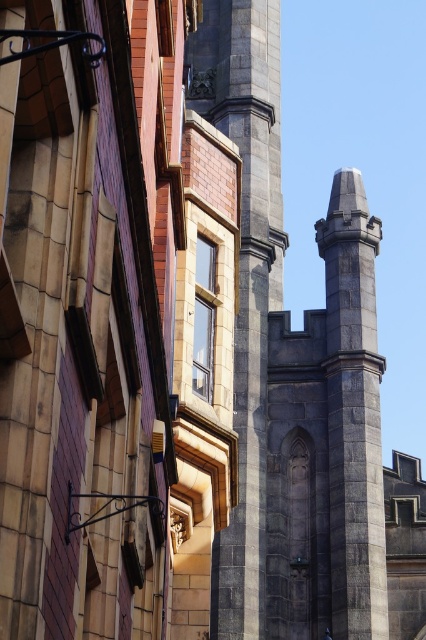
Measure the distance from gray stone tower at center to gray stone pillar at center.

They are 7.90 meters apart.

Which is above, gray stone tower at center or gray stone pillar at center?

Positioned higher is gray stone tower at center.

Measure the distance between point (253,220) and camera.

A distance of 89.61 meters exists between point (253,220) and camera.

The height and width of the screenshot is (640, 426). What are the coordinates of `gray stone tower at center` in the screenshot? It's located at (245, 275).